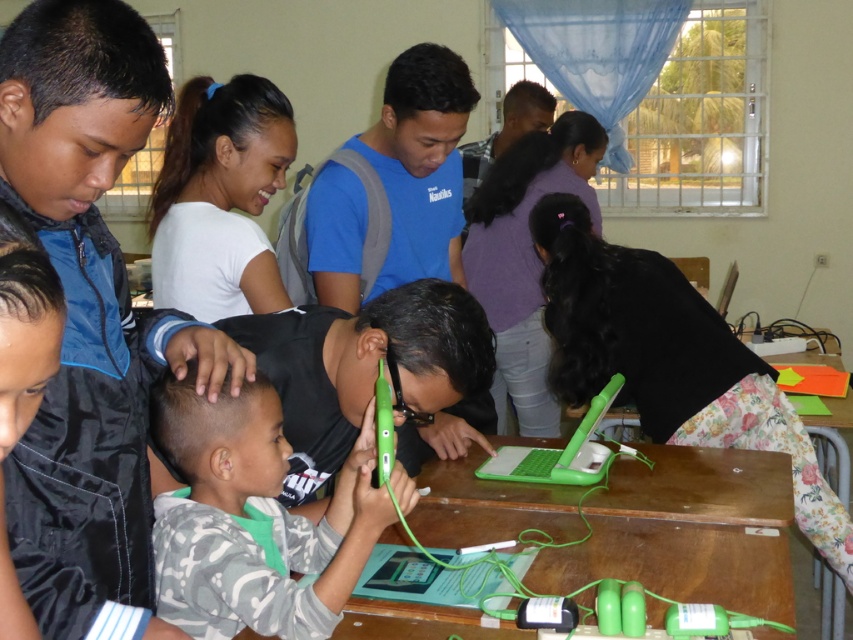
Question: Is green plastic table at center wider than green plastic laptop at center?

Choices:
 (A) no
 (B) yes

Answer: (B)

Question: Which object appears closest to the camera in this image?

Choices:
 (A) green matte tablet at center
 (B) green plastic laptop at center
 (C) green plastic phone at center
 (D) white matte shirt at upper center

Answer: (A)

Question: Considering the relative positions of white matte shirt at upper center and green plastic laptop at center in the image provided, where is white matte shirt at upper center located with respect to green plastic laptop at center?

Choices:
 (A) left
 (B) right

Answer: (A)

Question: Can you confirm if white matte shirt at upper center is thinner than green plastic phone at center?

Choices:
 (A) no
 (B) yes

Answer: (A)

Question: Among these objects, which one is farthest from the camera?

Choices:
 (A) green plastic table at center
 (B) green plastic phone at center

Answer: (A)

Question: Which object is positioned farthest from the green plastic phone at center?

Choices:
 (A) green plastic table at center
 (B) white matte shirt at upper center
 (C) green plastic laptop at center
 (D) green matte tablet at center

Answer: (B)